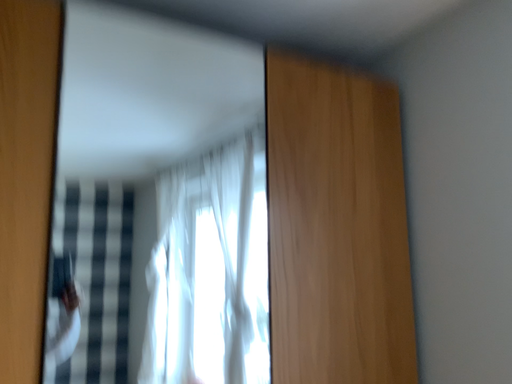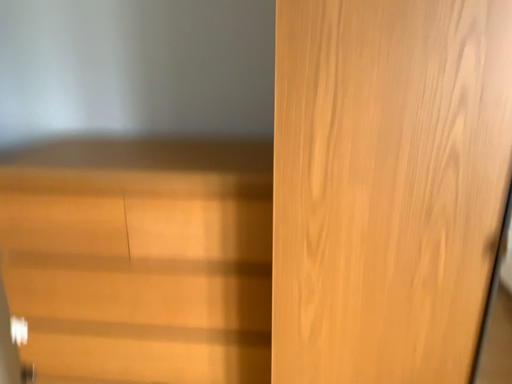
Question: How did the camera likely rotate when shooting the video?

Choices:
 (A) rotated left
 (B) rotated right

Answer: (A)